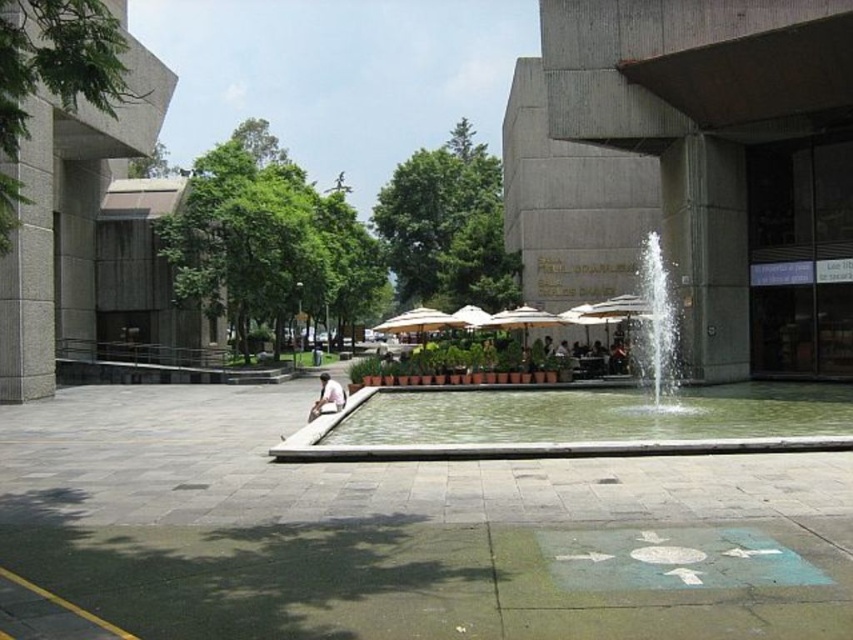
Is green concrete fountain at center to the left of green concrete water at center from the viewer's perspective?

No, green concrete fountain at center is not to the left of green concrete water at center.

Is green concrete fountain at center to the right of green concrete water at center from the viewer's perspective?

Yes, green concrete fountain at center is to the right of green concrete water at center.

Who is more forward, (753, 420) or (364, 388)?

Point (753, 420) is more forward.

Locate an element on the screen. green concrete fountain at center is located at coordinates (573, 417).